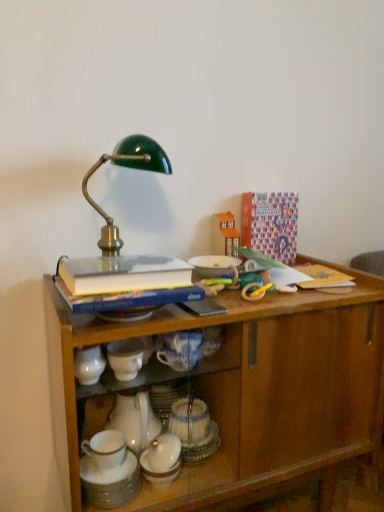
Describe the element at coordinates (127, 298) in the screenshot. I see `hardcover book at upper center` at that location.

What are the coordinates of `wooden cabinet at center` in the screenshot? It's located at (242, 391).

Is point (356, 435) positioned before point (92, 462)?

No, it is behind (92, 462).

Between wooden cabinet at center and white glossy cup at lower center, which one is positioned behind?

white glossy cup at lower center.

This screenshot has height=512, width=384. In order to click on the 2nd toy positioned above the white glossy cup at lower center (from the image's perspective) in this screenshot , I will do `click(224, 234)`.

Is white glossy cup at lower center smaller than wooden toy house at upper center, marked as the second toy in a front-to-back arrangement?

Indeed, white glossy cup at lower center has a smaller size compared to wooden toy house at upper center, marked as the second toy in a front-to-back arrangement.

Considering the positions of points (126, 451) and (218, 245), is point (126, 451) farther from camera compared to point (218, 245)?

No, it is not.

From a real-world perspective, who is located higher, white glossy cup at lower center or wooden toy house at upper center, the 1th toy viewed from the back?

From a 3D spatial view, wooden toy house at upper center, the 1th toy viewed from the back, is above.

Considering the positions of objects wooden toy house at upper center, arranged as the 1th toy when viewed from the top, and hardcover book at upper center in the image provided, who is more to the right, wooden toy house at upper center, arranged as the 1th toy when viewed from the top, or hardcover book at upper center?

wooden toy house at upper center, arranged as the 1th toy when viewed from the top.

Is wooden toy house at upper center, arranged as the 1th toy when viewed from the top, further to camera compared to hardcover book at upper center?

Yes.

From a real-world perspective, which is physically above, wooden toy house at upper center, arranged as the 1th toy when viewed from the top, or hardcover book at upper center?

wooden toy house at upper center, arranged as the 1th toy when viewed from the top, is physically above.

Consider the image. How different are the orientations of wooden toy house at upper center, arranged as the 1th toy when viewed from the top, and hardcover book at upper center in degrees?

They differ by 0.423 degrees in their facing directions.

Which is in front, wooden cabinet at center or rubber yellow and blue teething ring at upper right, the 2th toy from the top?

wooden cabinet at center is in front.

Considering the relative positions of wooden cabinet at center and rubber yellow and blue teething ring at upper right, placed as the 1th toy when sorted from bottom to top, in the image provided, is wooden cabinet at center to the left of rubber yellow and blue teething ring at upper right, placed as the 1th toy when sorted from bottom to top, from the viewer's perspective?

Yes, wooden cabinet at center is to the left of rubber yellow and blue teething ring at upper right, placed as the 1th toy when sorted from bottom to top.

From a real-world perspective, which object rests below the other?

wooden cabinet at center.

Could you tell me if wooden cabinet at center is turned towards rubber yellow and blue teething ring at upper right, which appears as the first toy when viewed from the front?

No, wooden cabinet at center is not turned towards rubber yellow and blue teething ring at upper right, which appears as the first toy when viewed from the front.

From a real-world perspective, who is located higher, rubber yellow and blue teething ring at upper right, which appears as the first toy when viewed from the front, or hardcover book at upper center?

From a 3D spatial view, hardcover book at upper center is above.

Which is in front, point (206, 284) or point (179, 287)?

The point (179, 287) is in front.

From the image's perspective, would you say rubber yellow and blue teething ring at upper right, which appears as the first toy when viewed from the front, is positioned over hardcover book at upper center?

No.

From the picture: From the image's perspective, does wooden cabinet at center appear lower than wooden toy house at upper center, which appears as the second toy when ordered from the bottom?

Yes, from the image's perspective, wooden cabinet at center is beneath wooden toy house at upper center, which appears as the second toy when ordered from the bottom.

Considering the relative positions of wooden cabinet at center and wooden toy house at upper center, the 1th toy viewed from the back, in the image provided, is wooden cabinet at center to the left of wooden toy house at upper center, the 1th toy viewed from the back, from the viewer's perspective?

Yes.

Considering the positions of points (76, 505) and (228, 211), is point (76, 505) farther from camera compared to point (228, 211)?

No, it is not.

Does rubber yellow and blue teething ring at upper right, the second toy from the back, turn towards wooden cabinet at center?

Yes, rubber yellow and blue teething ring at upper right, the second toy from the back, is oriented towards wooden cabinet at center.

Would you say rubber yellow and blue teething ring at upper right, the second toy from the back, is inside or outside wooden cabinet at center?

rubber yellow and blue teething ring at upper right, the second toy from the back, is located inside wooden cabinet at center.

Based on the photo, from a real-world perspective, between rubber yellow and blue teething ring at upper right, which appears as the first toy when viewed from the front, and wooden cabinet at center, who is vertically lower?

wooden cabinet at center is physically lower.

At what (x,y) coordinates should I click in order to perform the action: click on tableware below the wooden cabinet at center (from a real-world perspective). Please return your answer as a coordinate pair (x, y). This screenshot has height=512, width=384. Looking at the image, I should click on (110, 482).

Where is `the 2nd toy located above the white glossy cup at lower center (from a real-world perspective)`? Image resolution: width=384 pixels, height=512 pixels. the 2nd toy located above the white glossy cup at lower center (from a real-world perspective) is located at coordinates (224, 234).

Estimate the real-world distances between objects in this image. Which object is closer to wooden cabinet at center, white glossy cup at lower center or rubber yellow and blue teething ring at upper right, placed as the 1th toy when sorted from bottom to top?

Among the two, rubber yellow and blue teething ring at upper right, placed as the 1th toy when sorted from bottom to top, is located nearer to wooden cabinet at center.

From the picture: Which object lies nearer to the anchor point white glossy cup at lower center, wooden cabinet at center or hardcover book at upper center?

Among the two, wooden cabinet at center is located nearer to white glossy cup at lower center.

Estimate the real-world distances between objects in this image. Which object is closer to hardcover book at upper center, wooden toy house at upper center, which appears as the second toy when ordered from the bottom, or rubber yellow and blue teething ring at upper right, placed as the 1th toy when sorted from bottom to top?

rubber yellow and blue teething ring at upper right, placed as the 1th toy when sorted from bottom to top.

From the image, which object appears to be farther from hardcover book at upper center, wooden cabinet at center or rubber yellow and blue teething ring at upper right, the 2th toy from the top?

wooden cabinet at center lies further to hardcover book at upper center than the other object.

Estimate the real-world distances between objects in this image. Which object is further from hardcover book at upper center, wooden cabinet at center or wooden toy house at upper center, the 1th toy viewed from the back?

wooden toy house at upper center, the 1th toy viewed from the back, lies further to hardcover book at upper center than the other object.

When comparing their distances from rubber yellow and blue teething ring at upper right, which appears as the first toy when viewed from the front, does wooden cabinet at center or wooden toy house at upper center, which appears as the second toy when ordered from the bottom, seem closer?

wooden toy house at upper center, which appears as the second toy when ordered from the bottom, is positioned closer to the anchor rubber yellow and blue teething ring at upper right, which appears as the first toy when viewed from the front.

Looking at the image, which one is located closer to white glossy cup at lower center, hardcover book at upper center or wooden cabinet at center?

Based on the image, wooden cabinet at center appears to be nearer to white glossy cup at lower center.

Estimate the real-world distances between objects in this image. Which object is further from white glossy cup at lower center, wooden toy house at upper center, marked as the second toy in a front-to-back arrangement, or rubber yellow and blue teething ring at upper right, placed as the 1th toy when sorted from bottom to top?

Among the two, wooden toy house at upper center, marked as the second toy in a front-to-back arrangement, is located further to white glossy cup at lower center.

The image size is (384, 512). Identify the location of toy between hardcover book at upper center and white glossy cup at lower center vertically. (220, 282).

Find the location of a particular element. book between wooden toy house at upper center, which appears as the second toy when ordered from the bottom, and white glossy cup at lower center from top to bottom is located at coordinates (127, 298).

The height and width of the screenshot is (512, 384). I want to click on book between wooden cabinet at center and wooden toy house at upper center, arranged as the 1th toy when viewed from the top, from front to back, so click(x=127, y=298).

Image resolution: width=384 pixels, height=512 pixels. In order to click on desk between hardcover book at upper center and white glossy cup at lower center in the up-down direction in this screenshot , I will do `click(242, 391)`.